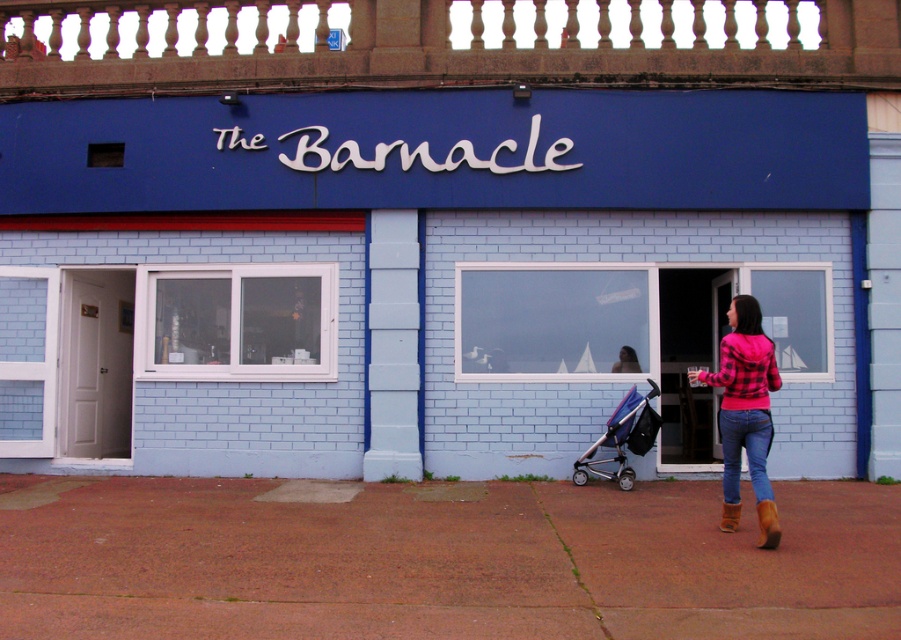
You are standing outside The Barnacle, a light blue building with white brick details. You see a pink plaid sweater at lower right. Can you reach the sweater without moving from your current position?

The pink plaid sweater at lower right is 7.15 meters away from you, so you cannot reach it without moving closer.

You are standing at the entrance of The Barnacle and need to place a 2 feet wide delivery box between the red brick pavement at lower center and the brown suede boot at lower right. Can the box fit in the space between them?

The red brick pavement at lower center and brown suede boot at lower right are 6.44 feet apart, so the 2 feet wide delivery box can fit in the space between them since the distance is greater than the box width.